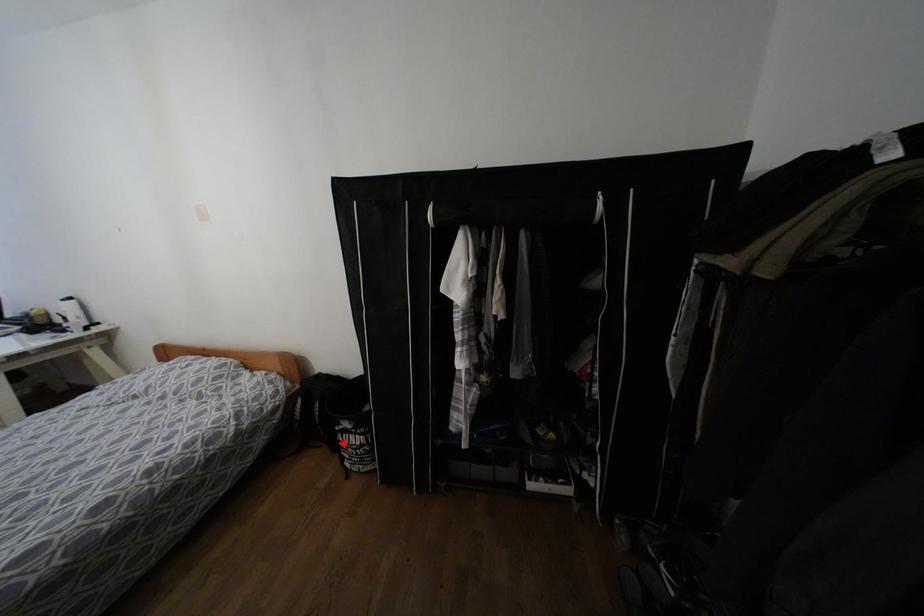
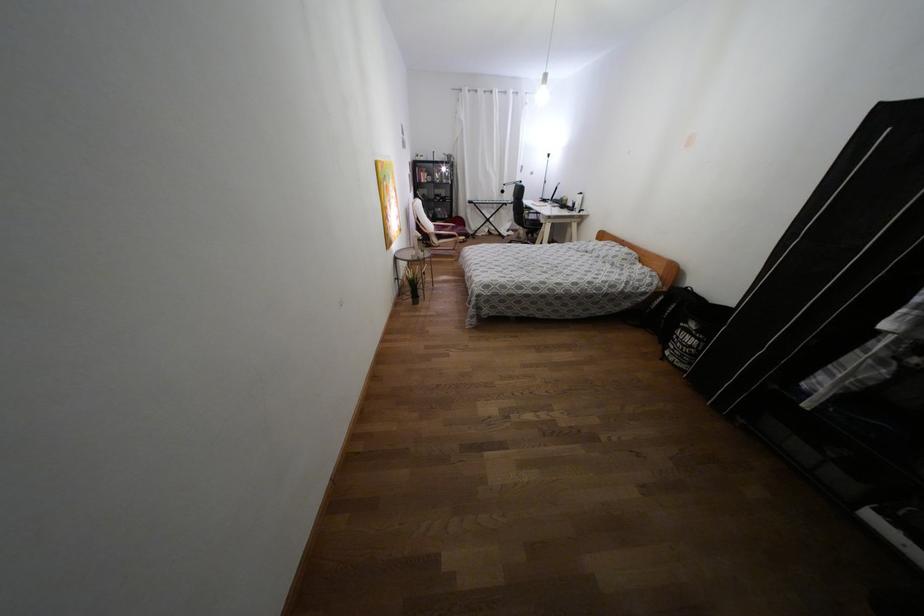
Question: I am providing you with two images of the same scene from different viewpoints. In image1, a red point is highlighted. Considering the same 3D point in image2, which of the following is correct?

Choices:
 (A) It is closer
 (B) It is farther

Answer: (A)